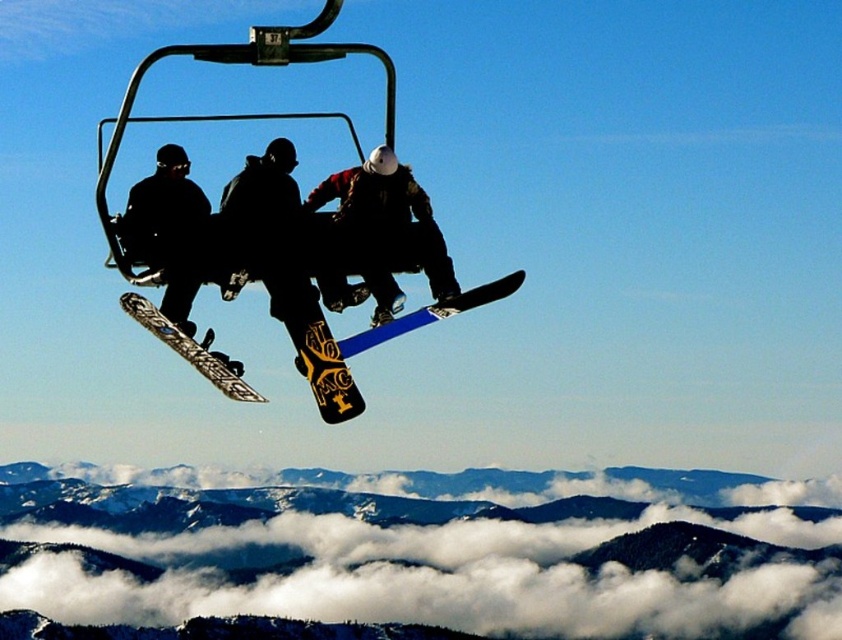
Question: Does blue matte snowboard at center have a greater width compared to black matte snowboard at center?

Choices:
 (A) yes
 (B) no

Answer: (A)

Question: Estimate the real-world distances between objects in this image. Which object is closer to the black matte snowboard at center?

Choices:
 (A) blue matte snowboard at center
 (B) snowy forested mountain at lower center
 (C) yellow matte snowboard at center

Answer: (A)

Question: Which object appears closest to the camera in this image?

Choices:
 (A) snowy forested mountain at lower center
 (B) yellow matte snowboard at center

Answer: (B)

Question: Which point appears closest to the camera in this image?

Choices:
 (A) (328, 276)
 (B) (184, 348)
 (C) (819, 481)
 (D) (510, 285)

Answer: (B)

Question: From the image, what is the correct spatial relationship of yellow matte snowboard at center in relation to blue matte snowboard at center?

Choices:
 (A) left
 (B) right

Answer: (A)

Question: Considering the relative positions of snowy forested mountain at lower center and black matte snowboard at center in the image provided, where is snowy forested mountain at lower center located with respect to black matte snowboard at center?

Choices:
 (A) left
 (B) right

Answer: (A)